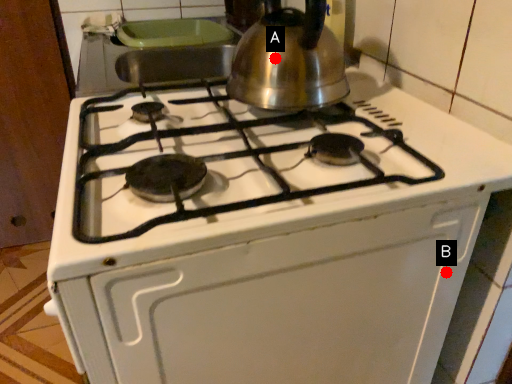
Question: Two points are circled on the image, labeled by A and B beside each circle. Which of the following is the farthest from the observer?

Choices:
 (A) A is further
 (B) B is further

Answer: (A)